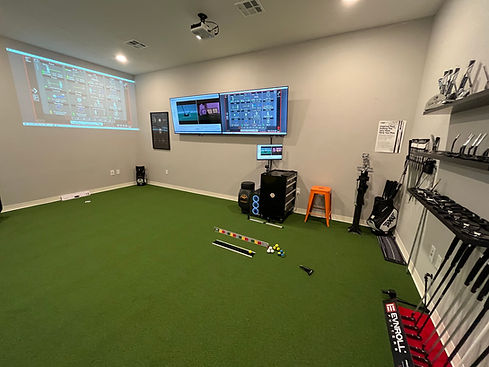
In order to click on ceiling light in this screenshot , I will do `click(120, 58)`.